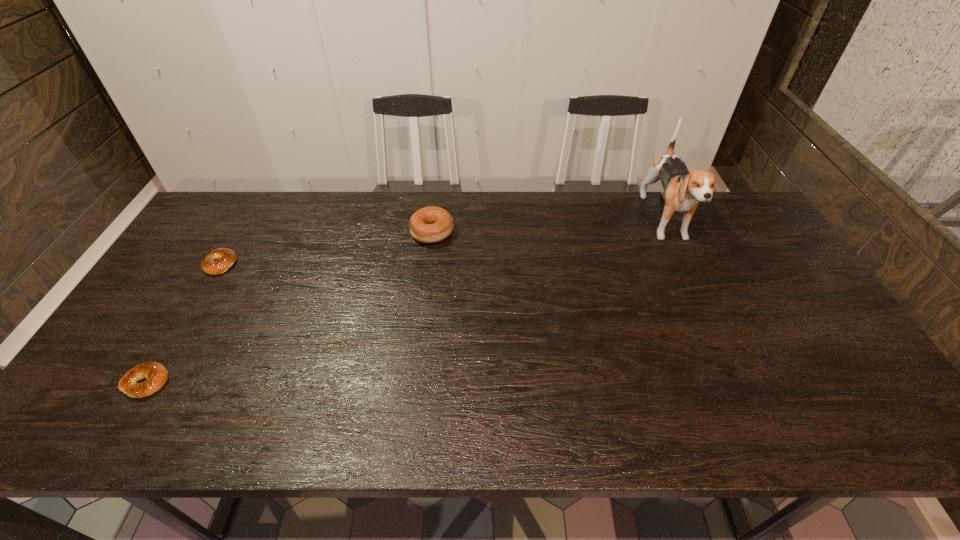
Find the location of a particular element. Image resolution: width=960 pixels, height=540 pixels. bagel that is the closest to the second farthest bagel is located at coordinates click(156, 374).

Image resolution: width=960 pixels, height=540 pixels. I want to click on bagel that stands as the closest to the second farthest bagel, so click(x=156, y=374).

At what (x,y) coordinates should I click in order to perform the action: click on free point that satisfies the following two spatial constraints: 1. on the back side of the nearest object; 2. on the right side of the rightmost bagel. Please return your answer as a coordinate pair (x, y). The width and height of the screenshot is (960, 540). Looking at the image, I should click on (235, 233).

Where is `free space that satisfies the following two spatial constraints: 1. on the back side of the nearest object; 2. on the left side of the farthest bagel`? The height and width of the screenshot is (540, 960). free space that satisfies the following two spatial constraints: 1. on the back side of the nearest object; 2. on the left side of the farthest bagel is located at coordinates (235, 233).